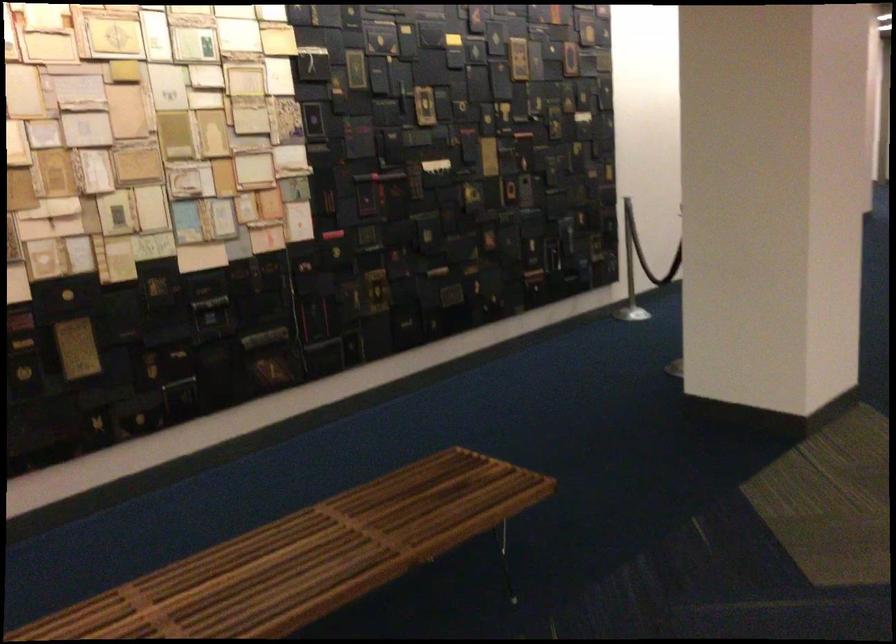
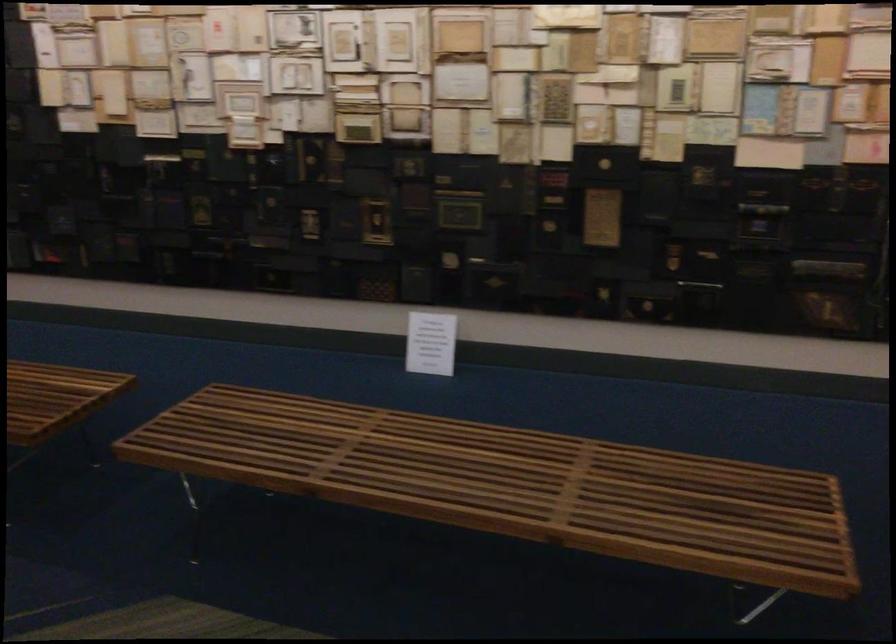
The point at (295,551) is marked in the first image. Where is the corresponding point in the second image?

(501, 475)